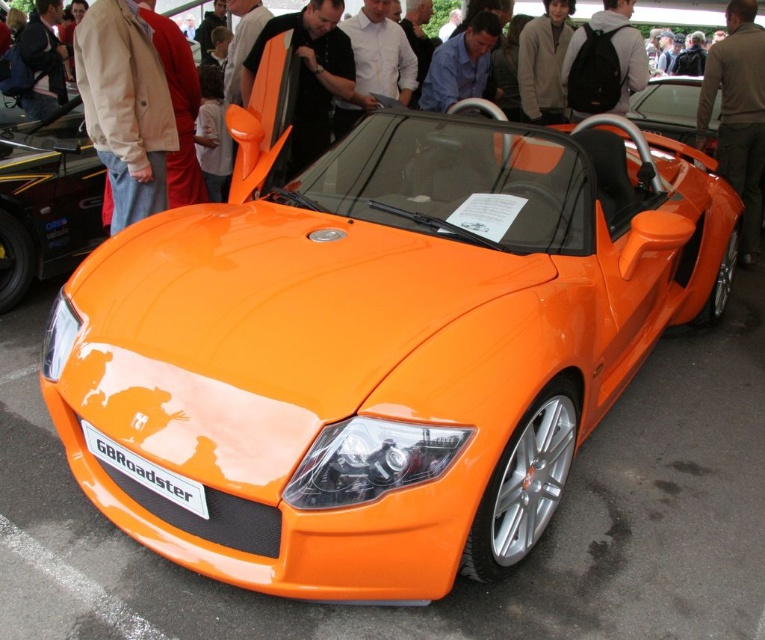
Question: Is brown leather jacket at center closer to the viewer compared to matte black license plate at front?

Choices:
 (A) no
 (B) yes

Answer: (A)

Question: Which point is closer to the camera?

Choices:
 (A) matte black license plate at front
 (B) black backpack at upper center

Answer: (A)

Question: Which object is closer to the camera taking this photo?

Choices:
 (A) orange matte roadster at center
 (B) beige fabric jacket at upper left
 (C) matte black license plate at front

Answer: (C)

Question: Which object is positioned farthest from the brown leather jacket at center?

Choices:
 (A) matte black license plate at front
 (B) black backpack at upper center

Answer: (A)

Question: Does orange matte sports car at center have a smaller size compared to matte black license plate at front?

Choices:
 (A) yes
 (B) no

Answer: (B)

Question: Can you confirm if beige fabric jacket at upper left is positioned to the right of orange matte roadster at center?

Choices:
 (A) no
 (B) yes

Answer: (A)